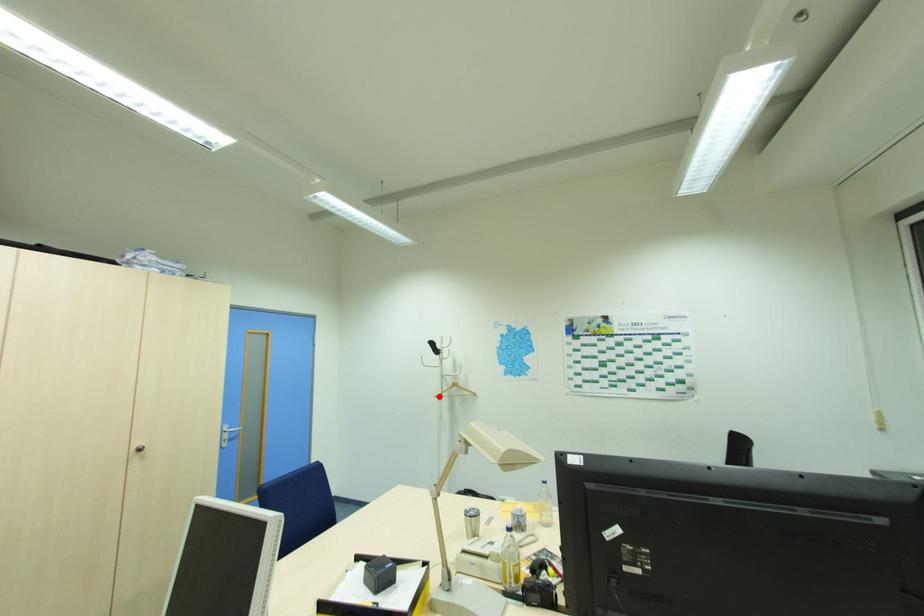
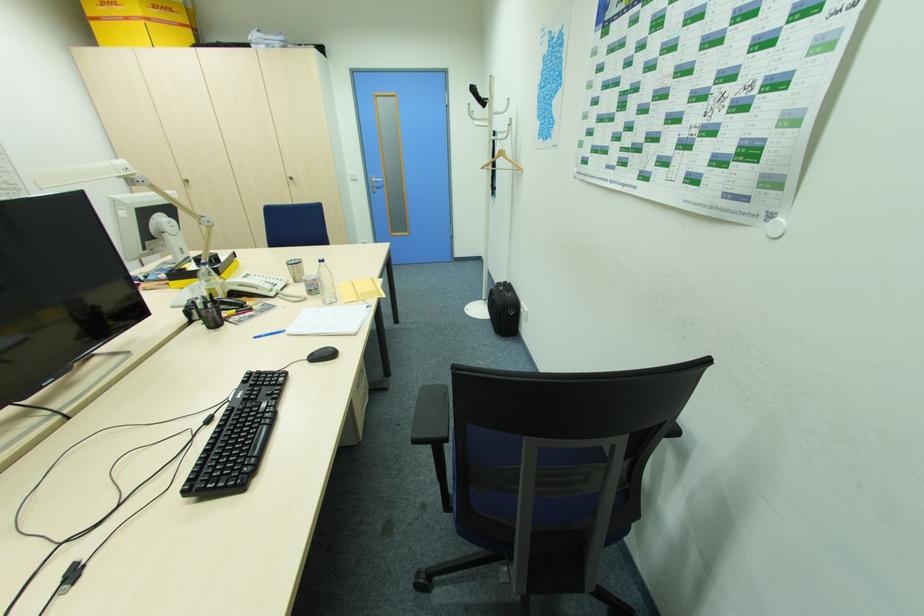
In the second image, find the point that corresponds to the highlighted location in the first image.

(485, 168)